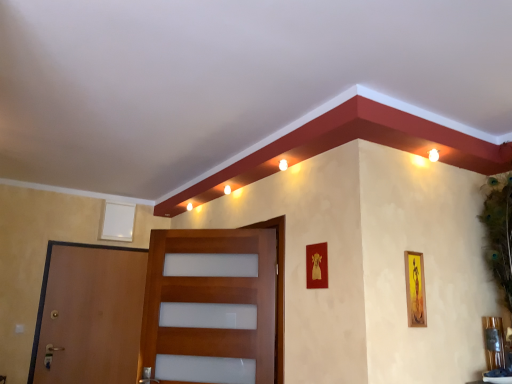
Question: From the image's perspective, is gold metallic picture frame at center, the second picture frame from the left, located beneath brown wooden door at left, arranged as the first door when viewed from the left?

Choices:
 (A) yes
 (B) no

Answer: (B)

Question: Is gold metallic picture frame at center, the second picture frame in the back-to-front sequence, further to camera compared to brown wooden door at left, positioned as the second door in right-to-left order?

Choices:
 (A) yes
 (B) no

Answer: (B)

Question: Is gold metallic picture frame at center, marked as the second picture frame in a front-to-back arrangement, completely or partially outside of brown wooden door at left, positioned as the second door in right-to-left order?

Choices:
 (A) yes
 (B) no

Answer: (A)

Question: From a real-world perspective, is gold metallic picture frame at center, which appears as the second picture frame when viewed from the right, on brown wooden door at left, which is counted as the first door, starting from the back?

Choices:
 (A) no
 (B) yes

Answer: (B)

Question: Is gold metallic picture frame at center, the second picture frame in the back-to-front sequence, thinner than brown wooden door at left, arranged as the first door when viewed from the left?

Choices:
 (A) yes
 (B) no

Answer: (A)

Question: Considering the relative positions of gold metallic picture frame at center, the second picture frame from the left, and brown wooden door at left, arranged as the first door when viewed from the left, in the image provided, is gold metallic picture frame at center, the second picture frame from the left, in front of brown wooden door at left, arranged as the first door when viewed from the left,?

Choices:
 (A) yes
 (B) no

Answer: (A)

Question: Is yellow matte picture frame at right, which is counted as the first picture frame, starting from the right, further to the viewer compared to wooden door at center, placed as the 2th door when sorted from back to front?

Choices:
 (A) no
 (B) yes

Answer: (A)

Question: Is wooden door at center, which is the first door in front-to-back order, at the back of yellow matte picture frame at right, placed as the third picture frame when sorted from left to right?

Choices:
 (A) no
 (B) yes

Answer: (A)

Question: Is yellow matte picture frame at right, placed as the third picture frame when sorted from left to right, closer to camera compared to wooden door at center, which is the first door in front-to-back order?

Choices:
 (A) no
 (B) yes

Answer: (B)

Question: Can you confirm if yellow matte picture frame at right, placed as the third picture frame when sorted from left to right, is positioned to the right of wooden door at center, placed as the 2th door when sorted from back to front?

Choices:
 (A) yes
 (B) no

Answer: (A)

Question: Is yellow matte picture frame at right, the third picture frame when ordered from back to front, wider than wooden door at center, placed as the 2th door when sorted from back to front?

Choices:
 (A) no
 (B) yes

Answer: (A)

Question: Is there a large distance between yellow matte picture frame at right, placed as the third picture frame when sorted from left to right, and wooden door at center, placed as the 2th door when sorted from back to front?

Choices:
 (A) yes
 (B) no

Answer: (A)

Question: Does brown wooden door at left, which is the 2th door in front-to-back order, have a larger size compared to white matte picture frame at upper left, arranged as the third picture frame when viewed from the right?

Choices:
 (A) yes
 (B) no

Answer: (A)